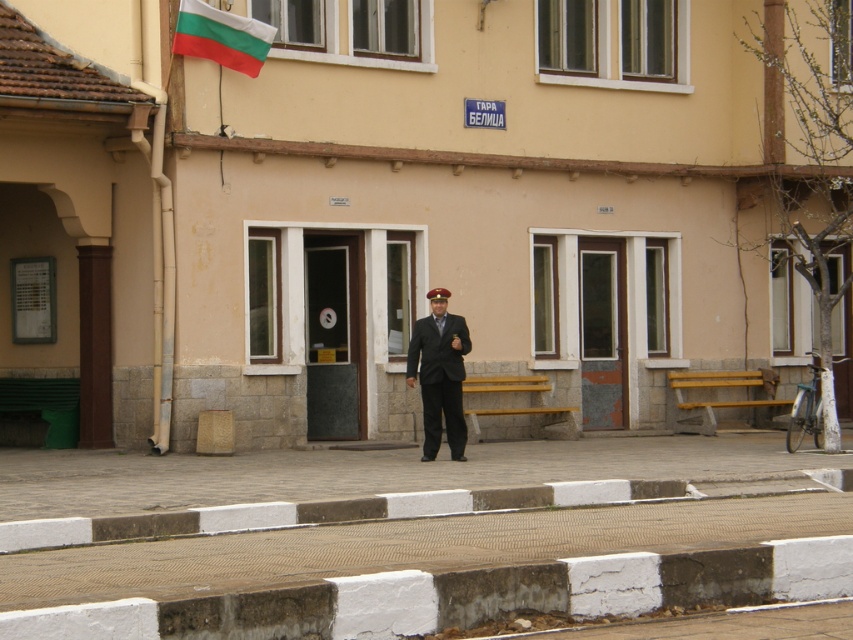
Question: Which object is closer to the camera taking this photo?

Choices:
 (A) dark suit at center
 (B) bulgarian flag at upper left

Answer: (A)

Question: Which of the following is the closest to the observer?

Choices:
 (A) dark suit at center
 (B) bulgarian flag at upper left

Answer: (A)

Question: Can you confirm if dark suit at center is wider than bulgarian flag at upper left?

Choices:
 (A) yes
 (B) no

Answer: (B)

Question: Is dark suit at center closer to the viewer compared to bulgarian flag at upper left?

Choices:
 (A) yes
 (B) no

Answer: (A)

Question: Is dark suit at center wider than bulgarian flag at upper left?

Choices:
 (A) no
 (B) yes

Answer: (A)

Question: Which object appears closest to the camera in this image?

Choices:
 (A) bulgarian flag at upper left
 (B) dark suit at center

Answer: (B)